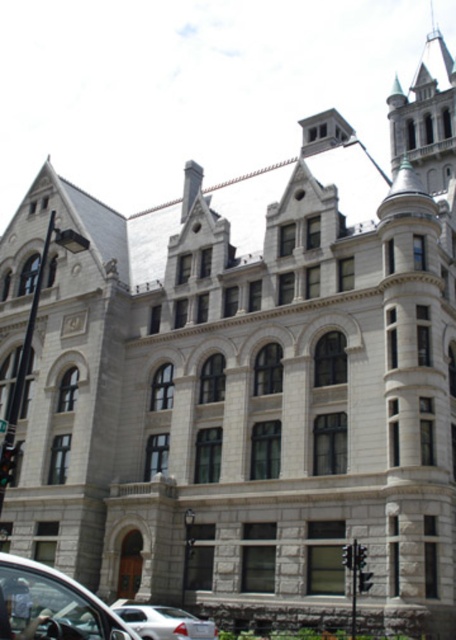
You are standing at the entrance of the grand, historic building with Gothic Revival architecture. You need to park your metallic silver car at lower left. Where exactly should you position your car relative to the building?

The metallic silver car at lower left should be positioned at point (53, 604) relative to the building.

You are standing in front of the historic Gothic Revival building. You notice two points marked on the building facade. The first point is at coordinate point(198, 634) and the second at point(369, 572). Which point is closer to you?

Point(198, 634) is in front of point(369, 572), so it is closer to you.

You are driving a car and want to park in the parking lot near the historic building. The parking spot next to the metallic traffic light at center can only accommodate vehicles narrower than the traffic light. Is the white matte car at lower left too wide to fit?

The white matte car at lower left is wider than the metallic traffic light at center, so it is too wide to fit in the parking spot next to the metallic traffic light at center.